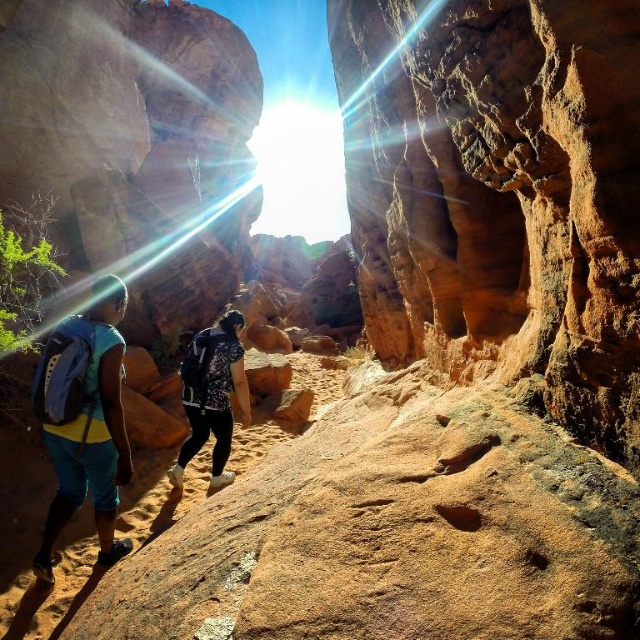
Question: Is rustic sandstone arch at center positioned at the back of blue fabric backpack at left?

Choices:
 (A) yes
 (B) no

Answer: (B)

Question: Can you confirm if rustic sandstone arch at center is positioned to the left of floral-patterned shirt at center?

Choices:
 (A) yes
 (B) no

Answer: (B)

Question: Among these objects, which one is farthest from the camera?

Choices:
 (A) blue fabric backpack at left
 (B) floral-patterned shirt at center
 (C) rustic sandstone arch at center

Answer: (B)

Question: Which point is closer to the camera taking this photo?

Choices:
 (A) (227, 324)
 (B) (108, 336)
 (C) (611, 282)

Answer: (C)

Question: Among these points, which one is nearest to the camera?

Choices:
 (A) (72, 360)
 (B) (422, 60)
 (C) (189, 419)

Answer: (A)

Question: Observing the image, what is the correct spatial positioning of rustic sandstone arch at center in reference to floral-patterned shirt at center?

Choices:
 (A) above
 (B) below

Answer: (A)